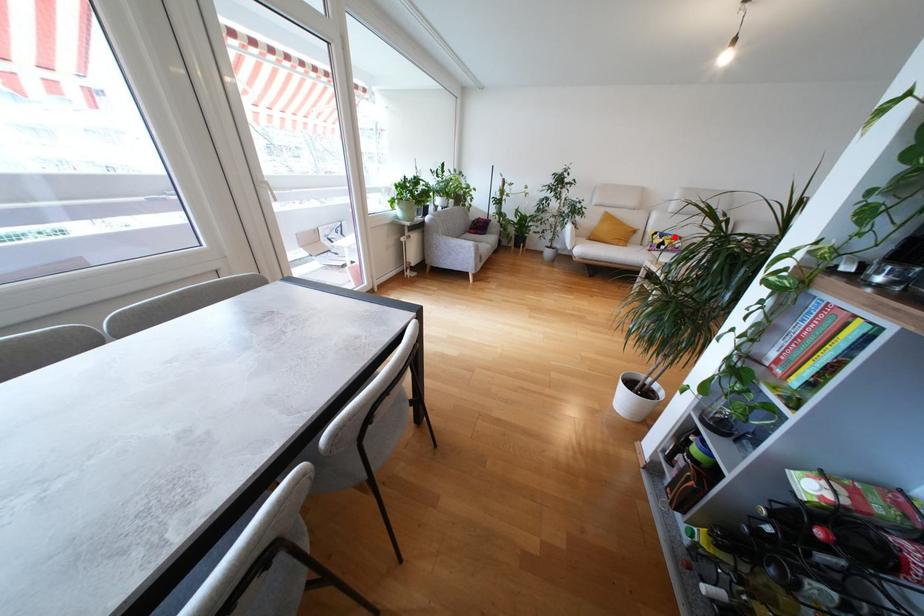
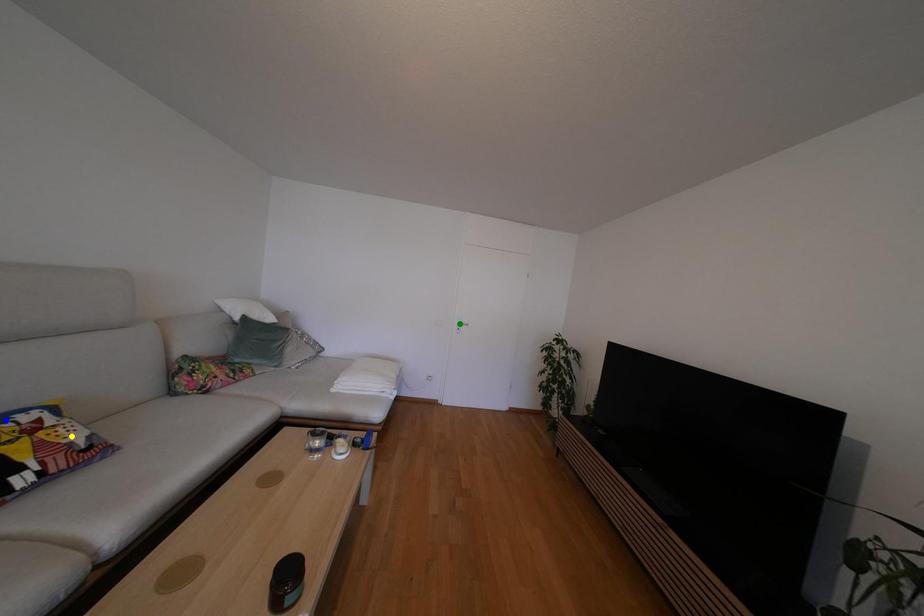
Question: I am providing you with two images of the same scene from different viewpoints. A red point is marked on the first image. You are given multiple points on the second image. In image 2, which mark is for the same physical point as the one in image 1?

Choices:
 (A) green point
 (B) blue point
 (C) yellow point

Answer: (B)